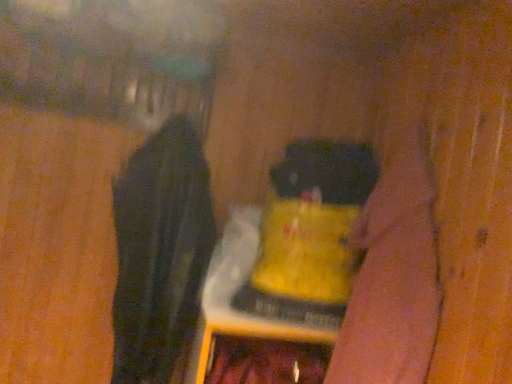
Question: In terms of height, does black fabric at left look taller or shorter compared to yellow matte bottle at center?

Choices:
 (A) short
 (B) tall

Answer: (B)

Question: Looking at their shapes, would you say black fabric at left is wider or thinner than yellow matte bottle at center?

Choices:
 (A) thin
 (B) wide

Answer: (A)

Question: Considering the real-world distances, which object is farthest from the velvety black cat at center?

Choices:
 (A) black fabric at left
 (B) yellow matte bottle at center

Answer: (A)

Question: Estimate the real-world distances between objects in this image. Which object is closer to the velvety black cat at center?

Choices:
 (A) yellow matte bottle at center
 (B) black fabric at left

Answer: (A)